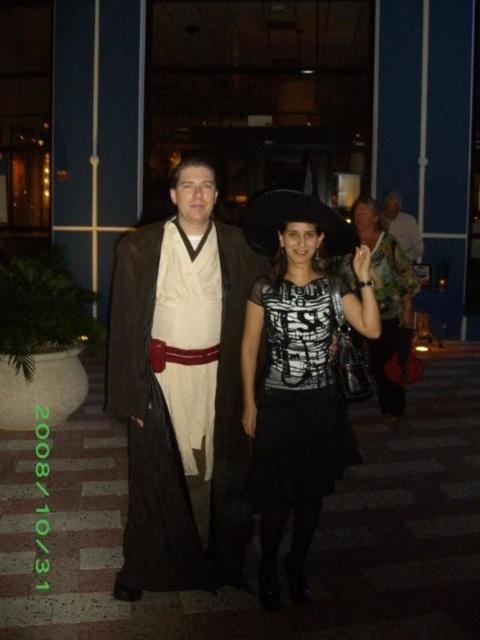
You are a photographer adjusting the camera settings to ensure both the black matte dress at center and the white fabric shirt at center are clearly visible in the photo. Which clothing item requires more focus on its vertical positioning to avoid being cut off by the frame?

The black matte dress at center requires more focus on its vertical positioning because it has a greater height compared to the white fabric shirt at center, making it more likely to be cut off if not properly framed.

You are a photographer adjusting the lighting for a photo shoot. You notice the black matte dress at center and the white fabric shirt at center. Which one is positioned lower in the frame?

The black matte dress at center is located below the white fabric shirt at center, so it is positioned lower in the frame.